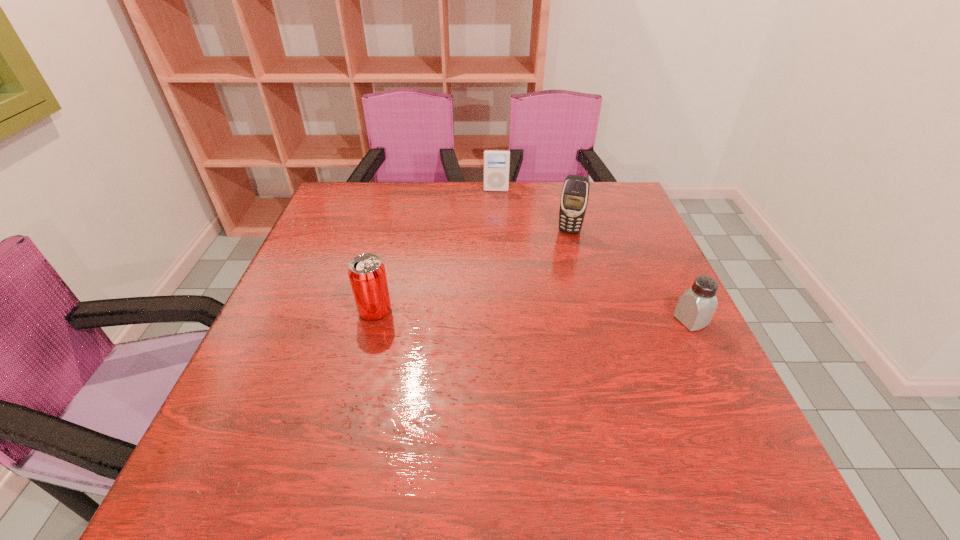
I want to click on free region at the right edge of the desktop, so click(x=697, y=367).

Identify the location of blank space at the far left corner. (372, 198).

This screenshot has width=960, height=540. What are the coordinates of `free point between the second farthest object and the leftmost object` in the screenshot? It's located at click(x=472, y=271).

Identify the location of free area in between the rightmost object and the cellular telephone. The width and height of the screenshot is (960, 540). pos(630,275).

Where is `unoccupied position between the third nearest object and the soda can`? The width and height of the screenshot is (960, 540). unoccupied position between the third nearest object and the soda can is located at coordinates (472, 271).

The width and height of the screenshot is (960, 540). I want to click on empty location between the rightmost object and the farthest object, so click(x=593, y=255).

Where is `vacant point located between the iPod and the cellular telephone`? This screenshot has width=960, height=540. vacant point located between the iPod and the cellular telephone is located at coordinates point(533,211).

Find the location of a particular element. The image size is (960, 540). empty space that is in between the farthest object and the shortest object is located at coordinates (593, 255).

At what (x,y) coordinates should I click in order to perform the action: click on empty location between the soda can and the saltshaker. Please return your answer as a coordinate pair (x, y). The height and width of the screenshot is (540, 960). Looking at the image, I should click on (533, 316).

Identify the location of vacant area that lies between the leftmost object and the farthest object. This screenshot has width=960, height=540. (436, 251).